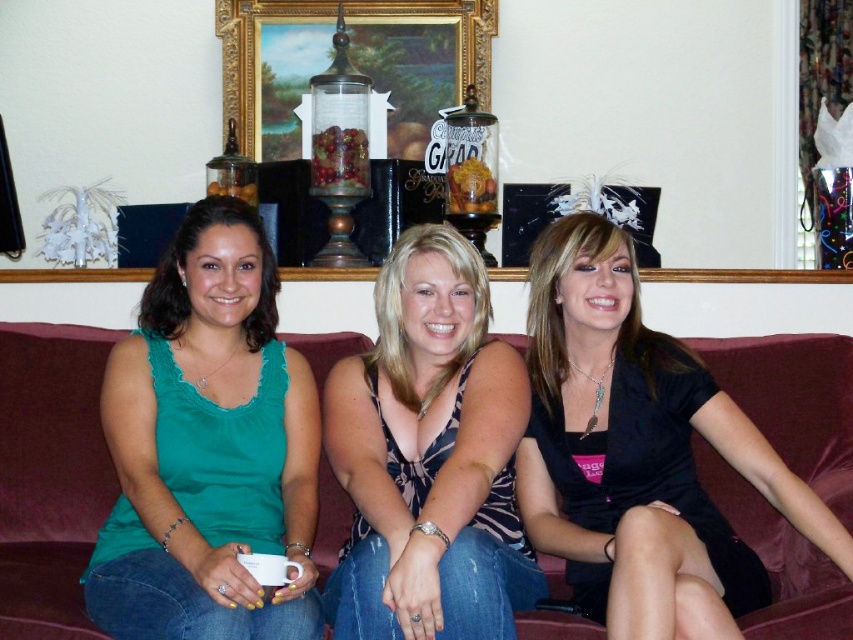
Is maroon fabric couch at center bigger than printed fabric tank top at center?

No, maroon fabric couch at center is not bigger than printed fabric tank top at center.

Is the position of maroon fabric couch at center more distant than that of printed fabric tank top at center?

That is True.

Is point (15, 630) in front of point (462, 588)?

No, (15, 630) is behind (462, 588).

Locate an element on the screen. The height and width of the screenshot is (640, 853). maroon fabric couch at center is located at coordinates (49, 476).

Can you confirm if green fabric tank top at center is shorter than printed fabric tank top at center?

No, green fabric tank top at center is not shorter than printed fabric tank top at center.

Consider the image. Who is more distant from viewer, [312,609] or [347,435]?

Positioned behind is point [347,435].

Does point (90, 602) lie in front of point (474, 436)?

That is True.

Where is `green fabric tank top at center`? green fabric tank top at center is located at coordinates (207, 448).

Does black satin dress at center appear on the right side of goldmetallicpicture frame at upper center?

Indeed, black satin dress at center is positioned on the right side of goldmetallicpicture frame at upper center.

Measure the distance between black satin dress at center and camera.

The distance of black satin dress at center from camera is 10.58 feet.

Is point (662, 632) positioned before point (457, 8)?

Yes, point (662, 632) is in front of point (457, 8).

Find the location of a particular element. This screenshot has width=853, height=640. black satin dress at center is located at coordinates (637, 452).